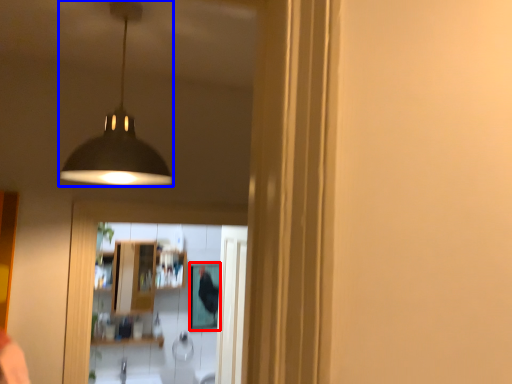
Question: Which point is further to the camera, mirror (highlighted by a red box) or lamp (highlighted by a blue box)?

Choices:
 (A) mirror
 (B) lamp

Answer: (A)